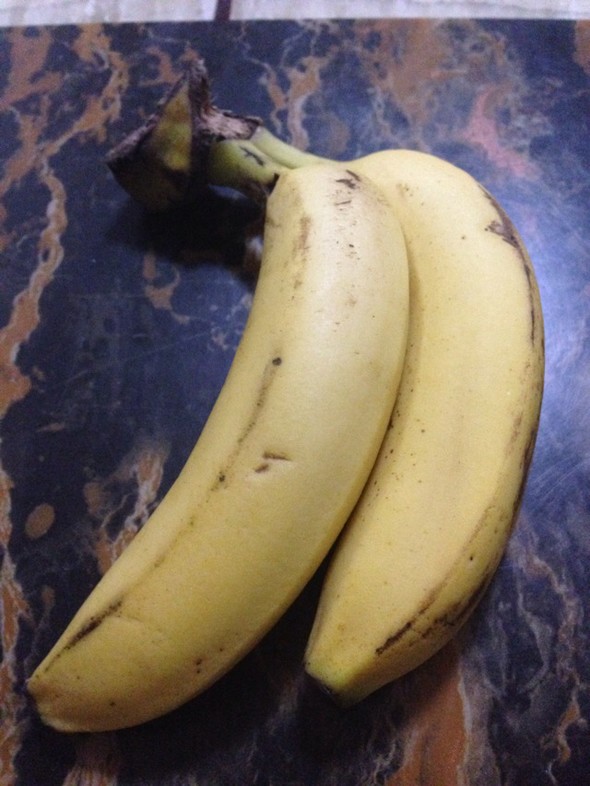
I want to click on black line on floor in background, so click(221, 9).